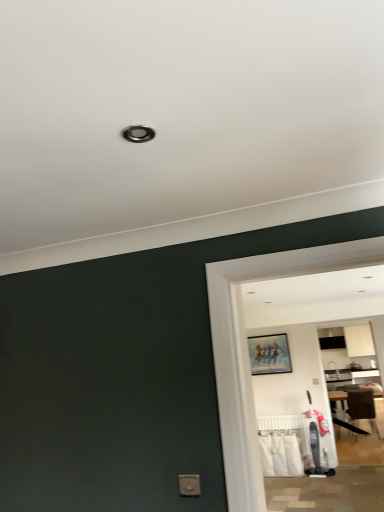
Question: Is the position of brown fabric chair at right more distant than that of white fabric laundry at lower right?

Choices:
 (A) yes
 (B) no

Answer: (A)

Question: Does brown fabric chair at right have a lesser width compared to white fabric laundry at lower right?

Choices:
 (A) no
 (B) yes

Answer: (A)

Question: Is brown fabric chair at right taller than white fabric laundry at lower right?

Choices:
 (A) yes
 (B) no

Answer: (A)

Question: Is brown fabric chair at right at the left side of white fabric laundry at lower right?

Choices:
 (A) no
 (B) yes

Answer: (A)

Question: Is brown fabric chair at right smaller than white fabric laundry at lower right?

Choices:
 (A) no
 (B) yes

Answer: (A)

Question: From the image's perspective, is brown fabric chair at right on white fabric laundry at lower right?

Choices:
 (A) yes
 (B) no

Answer: (B)

Question: Is brown fabric chair at right wider than matte wooden picture frame at center?

Choices:
 (A) yes
 (B) no

Answer: (A)

Question: Is brown fabric chair at right oriented towards matte wooden picture frame at center?

Choices:
 (A) no
 (B) yes

Answer: (A)

Question: Does brown fabric chair at right touch matte wooden picture frame at center?

Choices:
 (A) no
 (B) yes

Answer: (A)

Question: From a real-world perspective, is brown fabric chair at right below matte wooden picture frame at center?

Choices:
 (A) yes
 (B) no

Answer: (A)

Question: Is brown fabric chair at right to the right of matte wooden picture frame at center from the viewer's perspective?

Choices:
 (A) no
 (B) yes

Answer: (B)

Question: From the image's perspective, does brown fabric chair at right appear higher than matte wooden picture frame at center?

Choices:
 (A) yes
 (B) no

Answer: (B)

Question: Is matte wooden picture frame at center positioned in front of white plastic radiator at lower center?

Choices:
 (A) no
 (B) yes

Answer: (A)